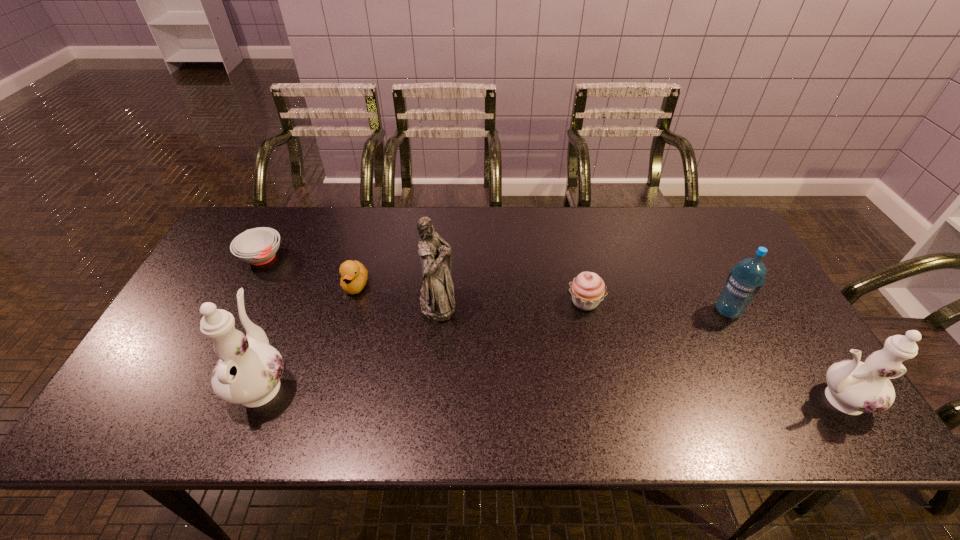
The image size is (960, 540). I want to click on free space at the right edge of the desktop, so click(725, 257).

Where is `free space at the far right corner`? The image size is (960, 540). free space at the far right corner is located at coordinates (692, 210).

Where is `free space between the second object from left to right and the cupcake`? The width and height of the screenshot is (960, 540). free space between the second object from left to right and the cupcake is located at coordinates (423, 342).

Where is `unoccupied area between the sixth object from right to left and the water bottle`? unoccupied area between the sixth object from right to left and the water bottle is located at coordinates (494, 347).

The width and height of the screenshot is (960, 540). In order to click on free space between the taller chinaware and the fifth object from left to right in this screenshot , I will do point(423,342).

This screenshot has width=960, height=540. In order to click on vacant area between the duckling and the cupcake in this screenshot , I will do `click(470, 294)`.

Locate an element on the screen. free spot between the soup bowl and the water bottle is located at coordinates click(494, 284).

Locate an element on the screen. The width and height of the screenshot is (960, 540). vacant space that's between the shorter chinaware and the left chinaware is located at coordinates (550, 391).

Where is `free space between the soup bowl and the third object from left to right`? The height and width of the screenshot is (540, 960). free space between the soup bowl and the third object from left to right is located at coordinates (309, 272).

Where is `object that is the fourth closest to the shorter chinaware`? The height and width of the screenshot is (540, 960). object that is the fourth closest to the shorter chinaware is located at coordinates (354, 274).